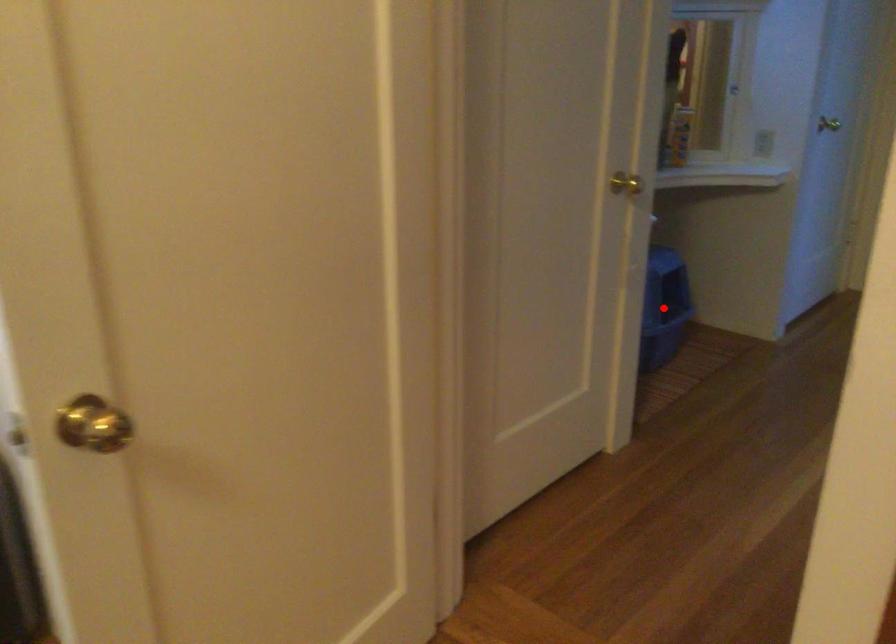
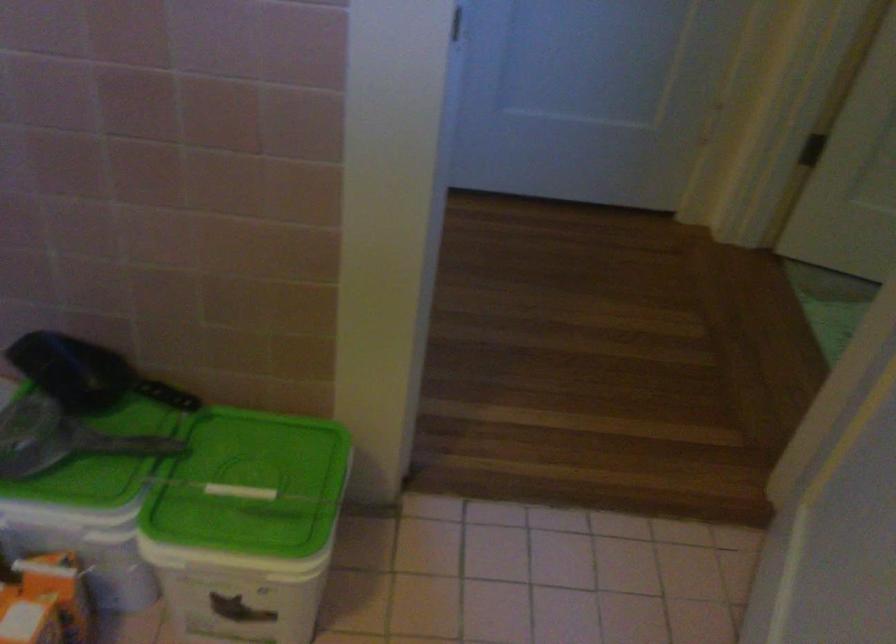
Question: I am providing you with two images of the same scene from different viewpoints. A red point is marked on the first image. Is the red point's position out of view in image 2?

Choices:
 (A) Yes
 (B) No

Answer: (A)